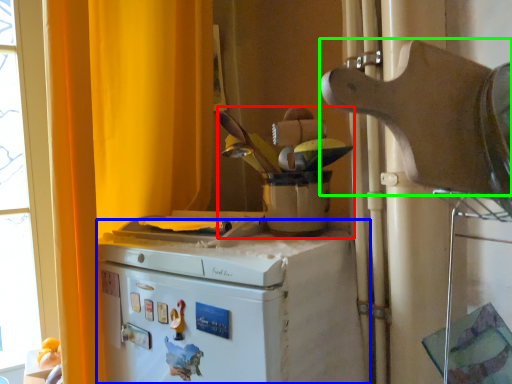
Question: Considering the real-world distances, which object is closest to appliance (highlighted by a red box)? home appliance (highlighted by a blue box) or appliance (highlighted by a green box).

Choices:
 (A) home appliance
 (B) appliance

Answer: (A)